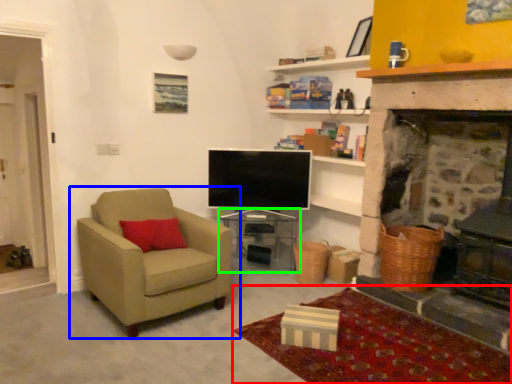
Question: Which object is the closest to the plain (highlighted by a red box)? Choose among these: chair (highlighted by a blue box) or table (highlighted by a green box).

Choices:
 (A) chair
 (B) table

Answer: (A)